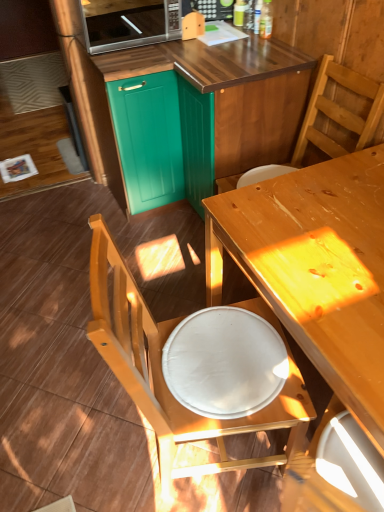
Question: Considering the relative positions of white glossy plate at lower center and wooden chair at lower left, the second chair in the top-to-bottom sequence, in the image provided, is white glossy plate at lower center to the left or to the right of wooden chair at lower left, the second chair in the top-to-bottom sequence,?

Choices:
 (A) right
 (B) left

Answer: (A)

Question: From their relative heights in the image, would you say white glossy plate at lower center is taller or shorter than wooden chair at lower left, the second chair in the top-to-bottom sequence?

Choices:
 (A) tall
 (B) short

Answer: (B)

Question: Which of these objects is positioned farthest from the teal wood cabinet at upper center, marked as the 2th cabinetry in a left-to-right arrangement?

Choices:
 (A) white glossy plate at lower center
 (B) wooden table at center
 (C) wooden chair at upper right, arranged as the first chair when viewed from the top
 (D) satin silver microwave at upper center
 (E) teal matte cabinet at upper center, arranged as the second cabinetry when viewed from the right

Answer: (A)

Question: Considering the real-world distances, which object is closest to the teal wood cabinet at upper center, marked as the 1th cabinetry in a right-to-left arrangement?

Choices:
 (A) wooden chair at lower left, the second chair in the top-to-bottom sequence
 (B) white glossy plate at lower center
 (C) satin silver microwave at upper center
 (D) wooden table at center
 (E) teal matte cabinet at upper center, positioned as the 1th cabinetry in left-to-right order

Answer: (E)